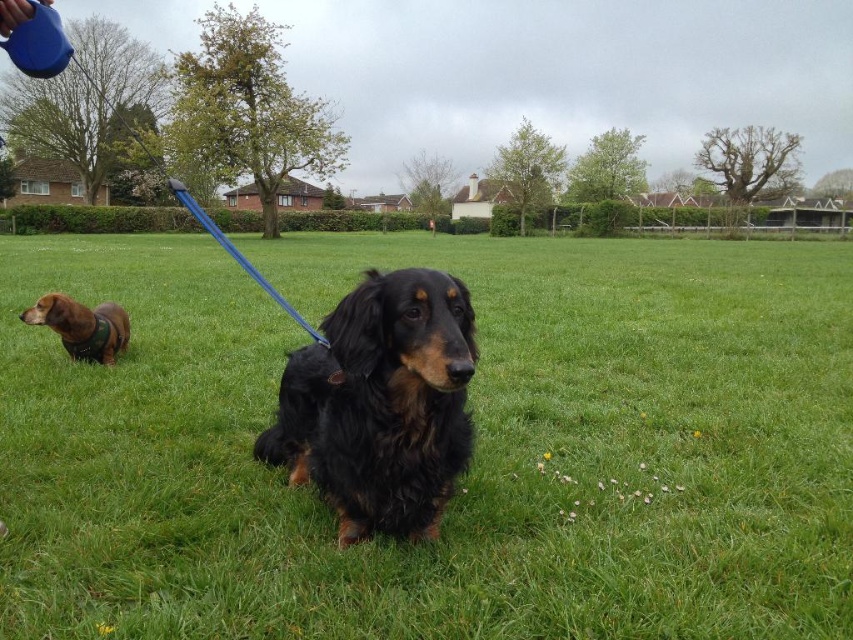
Who is positioned more to the left, green grass at center or brown fur dog at left?

Positioned to the left is brown fur dog at left.

Is green grass at center smaller than brown fur dog at left?

Actually, green grass at center might be larger than brown fur dog at left.

What do you see at coordinates (473, 456) in the screenshot? I see `green grass at center` at bounding box center [473, 456].

You are a GUI agent. You are given a task and a screenshot of the screen. Output one action in this format:
    pyautogui.click(x=<x>, y=<y>)
    Task: Click on the green grass at center
    The height and width of the screenshot is (640, 853).
    Given the screenshot: What is the action you would take?
    pyautogui.click(x=473, y=456)

Which is above, green grass at center or shiny black fur at center?

green grass at center

Is green grass at center further to the viewer compared to shiny black fur at center?

Yes.

Which is in front, point (740, 305) or point (401, 342)?

Positioned in front is point (401, 342).

Find the location of a particular element. green grass at center is located at coordinates (473, 456).

Which of these two, shiny black fur at center or brown fur dog at left, stands shorter?

With less height is brown fur dog at left.

Who is positioned more to the left, shiny black fur at center or brown fur dog at left?

brown fur dog at left is more to the left.

Is point (364, 516) more distant than point (108, 339)?

That is False.

Locate an element on the screen. This screenshot has width=853, height=640. shiny black fur at center is located at coordinates [380, 404].